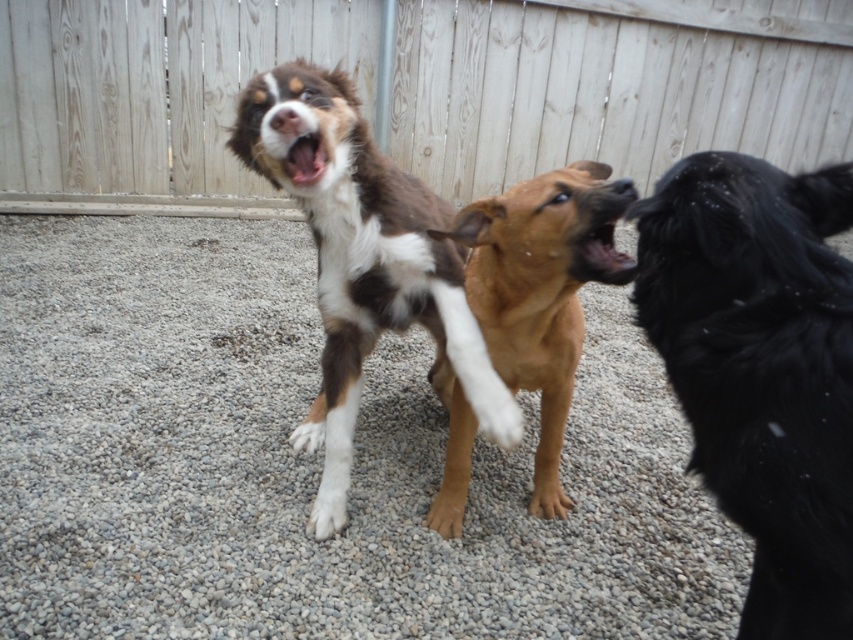
Question: Is white fur at center thinner than white fur at lower center?

Choices:
 (A) yes
 (B) no

Answer: (B)

Question: Estimate the real-world distances between objects in this image. Which object is farther from the white fur at lower center?

Choices:
 (A) gray gravel at center
 (B) brown fur paw at center
 (C) brown and white fur dog at center

Answer: (A)

Question: Is gray gravel at center positioned at the back of white fur at center?

Choices:
 (A) no
 (B) yes

Answer: (A)

Question: Which object is farther from the camera taking this photo?

Choices:
 (A) brown and white fur dog at center
 (B) white fur at lower center

Answer: (B)

Question: Based on their relative distances, which object is nearer to the brown fur paw at center?

Choices:
 (A) black fluffy dog at right
 (B) white fur at lower center
 (C) white fur at center
 (D) wooden fence at upper center

Answer: (C)

Question: Is wooden fence at upper center wider than white fur at lower center?

Choices:
 (A) yes
 (B) no

Answer: (A)